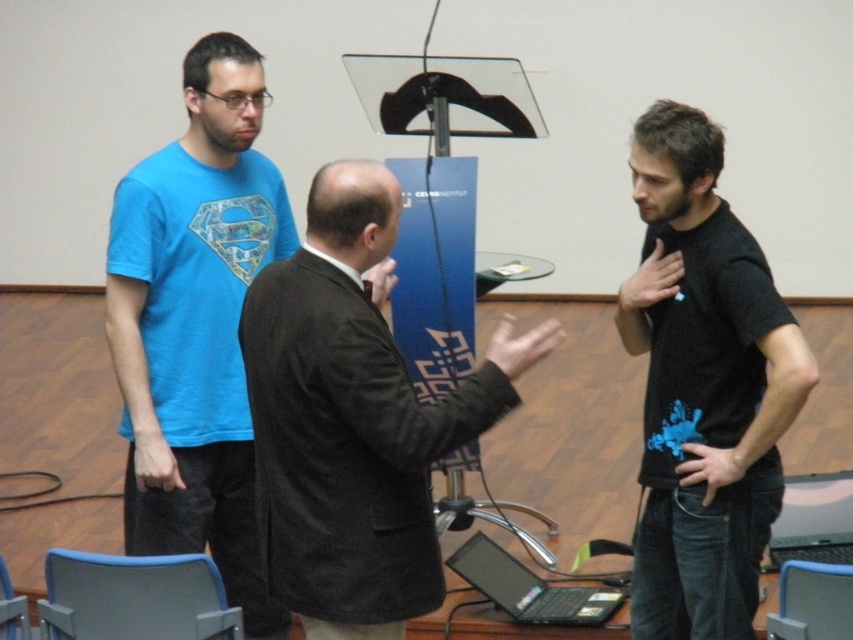
Does point (512, 396) lie behind point (589, 600)?

No, (512, 396) is in front of (589, 600).

Based on the photo, is dark brown suit at center wider than black glossy laptop at lower center?

Yes.

Find the location of a particular element. The image size is (853, 640). dark brown suit at center is located at coordinates (355, 417).

Between point (408, 381) and point (830, 476), which one is positioned in front?

Point (408, 381)

Describe the element at coordinates (355, 417) in the screenshot. I see `dark brown suit at center` at that location.

Locate an element on the screen. This screenshot has width=853, height=640. dark brown suit at center is located at coordinates (355, 417).

Which is more to the left, black glossy laptop at lower center or black plastic laptop at lower right?

From the viewer's perspective, black glossy laptop at lower center appears more on the left side.

Does point (605, 596) come in front of point (834, 560)?

No, it is not.

Which is behind, point (461, 566) or point (851, 556)?

Positioned behind is point (851, 556).

I want to click on black glossy laptop at lower center, so click(531, 588).